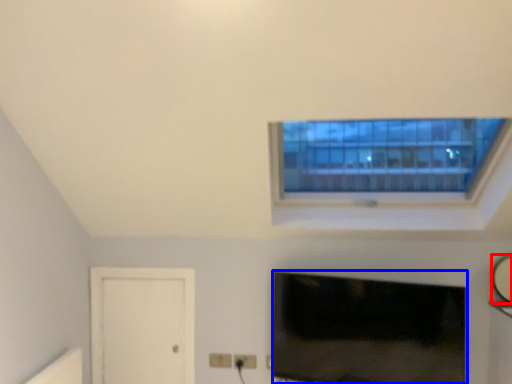
Question: Which object is further to the camera taking this photo, mirror (highlighted by a red box) or television (highlighted by a blue box)?

Choices:
 (A) mirror
 (B) television

Answer: (A)